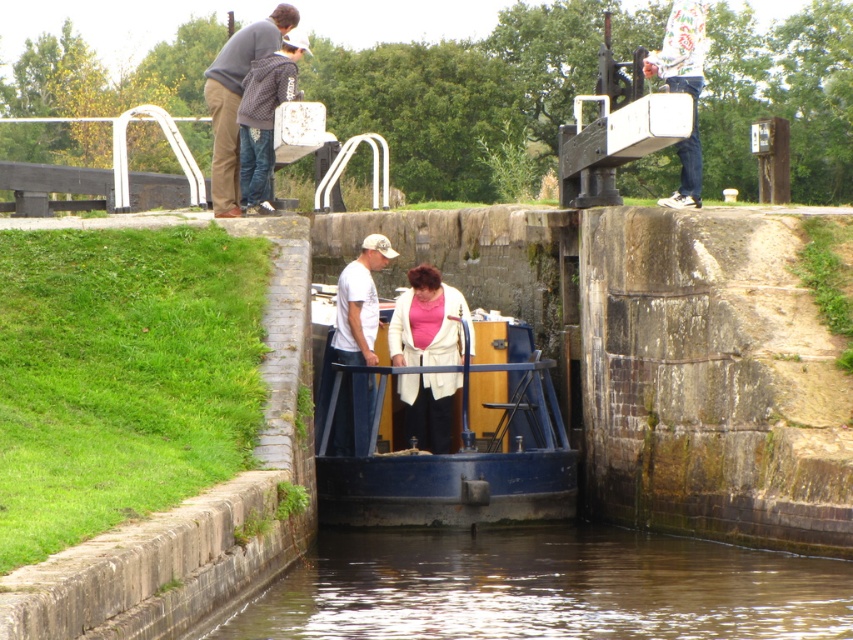
Question: Is matte gray sweater at upper left closer to the viewer compared to white printed sweater at upper center?

Choices:
 (A) yes
 (B) no

Answer: (B)

Question: Based on their relative distances, which object is nearer to the brown murky water at lower center?

Choices:
 (A) blue polished wood boat at center
 (B) white printed sweater at upper center

Answer: (A)

Question: Which point is closer to the camera?

Choices:
 (A) (532, 401)
 (B) (680, 173)

Answer: (A)

Question: Is matte white coat at center smaller than white cotton t-shirt at center?

Choices:
 (A) no
 (B) yes

Answer: (B)

Question: Which point is closer to the camera?

Choices:
 (A) (219, 170)
 (B) (724, 566)
 (C) (477, 474)

Answer: (B)

Question: Can you confirm if blue polished wood boat at center is positioned to the left of white cotton t-shirt at center?

Choices:
 (A) yes
 (B) no

Answer: (B)